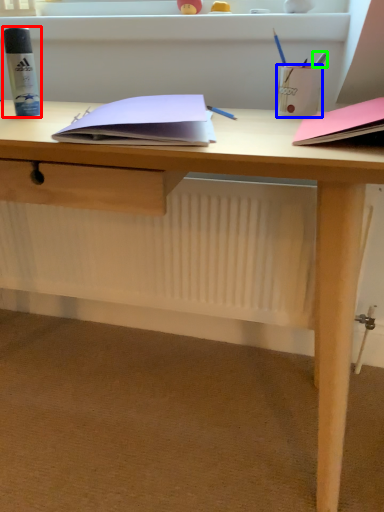
Question: Which object is the farthest from stationery (highlighted by a red box)? Choose among these: stationery (highlighted by a blue box) or stationery (highlighted by a green box).

Choices:
 (A) stationery
 (B) stationery

Answer: (B)